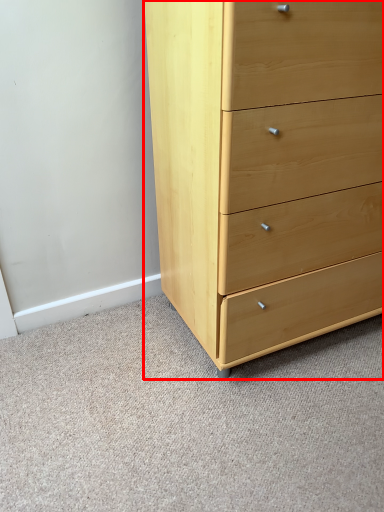
Question: From the image, what is the correct spatial relationship of chest of drawers (annotated by the red box) in relation to plain?

Choices:
 (A) right
 (B) left

Answer: (A)